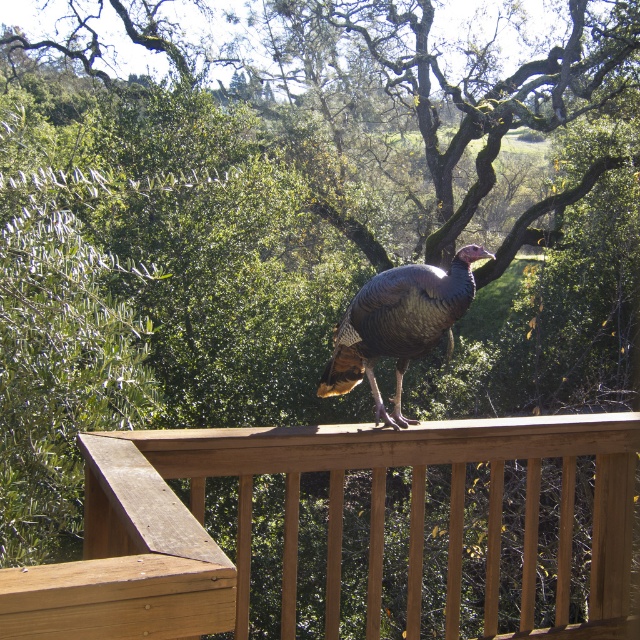
Question: Which point is closer to the camera?

Choices:
 (A) gray matte turkey at center
 (B) brown wooden railing at upper center

Answer: (B)

Question: Which point appears closest to the camera in this image?

Choices:
 (A) (349, 323)
 (B) (595, 573)

Answer: (A)

Question: Which point is closer to the camera taking this photo?

Choices:
 (A) (429, 317)
 (B) (595, 476)

Answer: (A)

Question: Is brown wooden railing at upper center in front of gray matte turkey at center?

Choices:
 (A) no
 (B) yes

Answer: (B)

Question: Is brown wooden railing at upper center positioned at the back of gray matte turkey at center?

Choices:
 (A) yes
 (B) no

Answer: (B)

Question: Considering the relative positions of brown wooden railing at upper center and gray matte turkey at center in the image provided, where is brown wooden railing at upper center located with respect to gray matte turkey at center?

Choices:
 (A) above
 (B) below

Answer: (B)